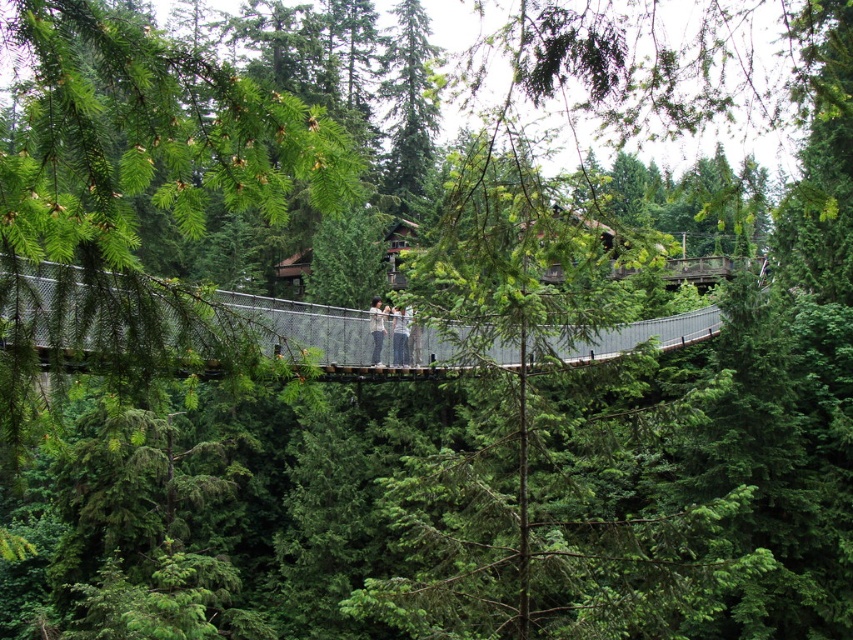
Question: Does metallic gray bridge at center lie in front of light gray fabric pants at center?

Choices:
 (A) no
 (B) yes

Answer: (B)

Question: In this image, where is metallic gray bridge at center located relative to light gray fabric pants at center?

Choices:
 (A) right
 (B) left

Answer: (A)

Question: Can you confirm if metallic gray bridge at center is positioned to the right of light gray fabric pants at center?

Choices:
 (A) yes
 (B) no

Answer: (A)

Question: Which object is farther from the camera taking this photo?

Choices:
 (A) metallic gray bridge at center
 (B) light gray fabric pants at center

Answer: (B)

Question: Which is farther from the light gray fabric pants at center?

Choices:
 (A) metallic gray bridge at center
 (B) light gray fabric jacket at center

Answer: (A)

Question: Which point is farther to the camera?

Choices:
 (A) (381, 330)
 (B) (397, 307)

Answer: (A)